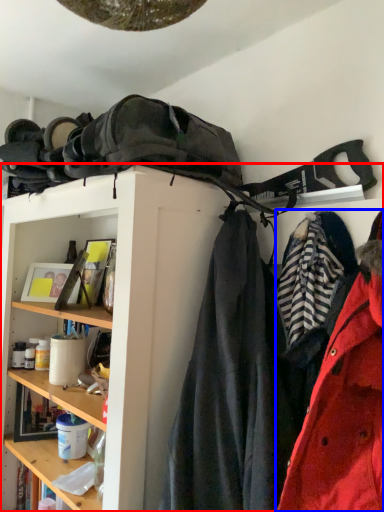
Question: Which point is further to the camera, shelf (highlighted by a red box) or coat (highlighted by a blue box)?

Choices:
 (A) shelf
 (B) coat

Answer: (B)